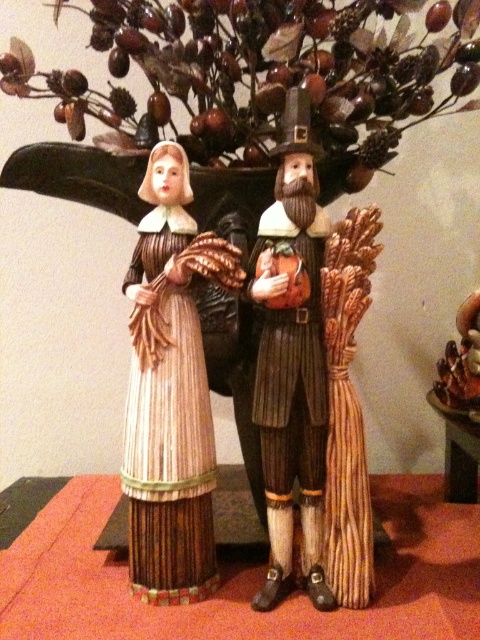
Which of these two, wooden pilgrim couple at center or wooden table at center, stands taller?

Standing taller between the two is wooden pilgrim couple at center.

Who is positioned more to the right, wooden pilgrim couple at center or wooden table at center?

wooden table at center

Does point (348, 451) lie behind point (111, 497)?

No, (348, 451) is closer to viewer.

You are a GUI agent. You are given a task and a screenshot of the screen. Output one action in this format:
    pyautogui.click(x=<x>, y=<y>)
    Task: Click on the wooden pilgrim couple at center
    Image resolution: width=480 pixels, height=640 pixels.
    Given the screenshot: What is the action you would take?
    pyautogui.click(x=312, y=378)

Is the position of wooden pilgrim couple at center more distant than that of wooden table at lower right?

That is False.

Can you confirm if wooden pilgrim couple at center is shorter than wooden table at lower right?

No.

Is point (256, 266) less distant than point (475, 465)?

Yes.

Locate an element on the screen. The width and height of the screenshot is (480, 640). wooden pilgrim couple at center is located at coordinates 312,378.

Who is shorter, wooden table at center or wooden straw doll at center?

wooden table at center

Who is higher up, wooden table at center or wooden straw doll at center?

wooden straw doll at center

This screenshot has height=640, width=480. Describe the element at coordinates (241, 577) in the screenshot. I see `wooden table at center` at that location.

What are the coordinates of `wooden table at center` in the screenshot? It's located at (241, 577).